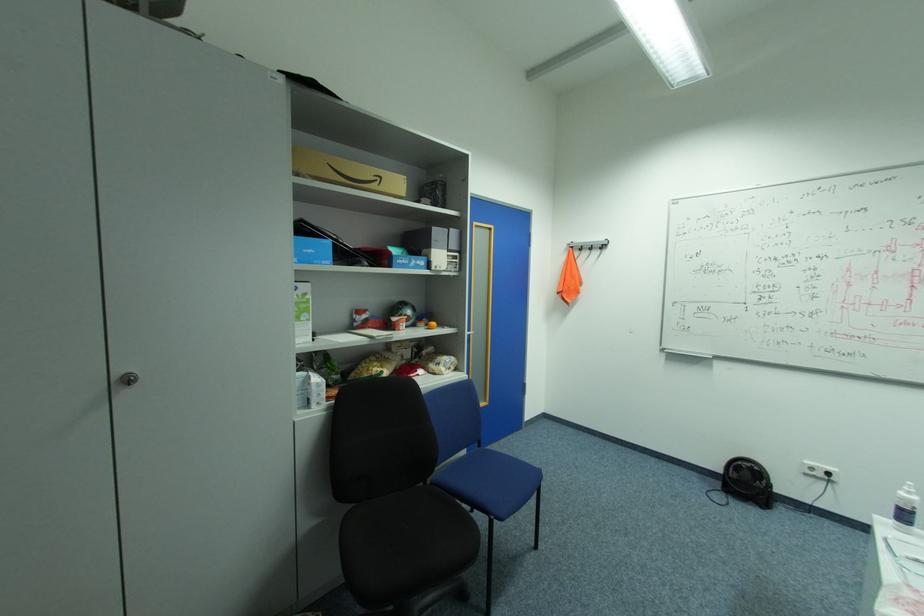
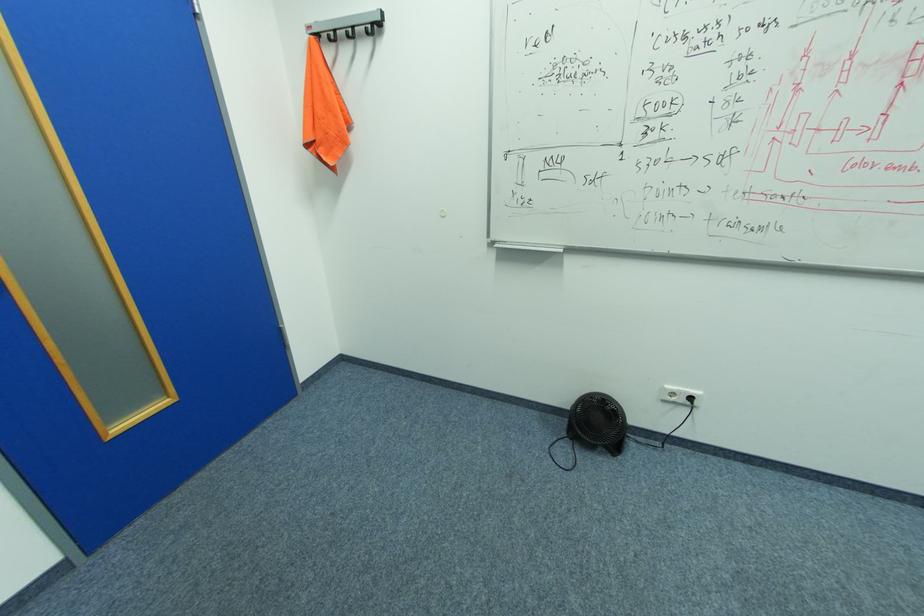
Find the pixel in the second image that matches point (578, 246) in the first image.

(324, 34)